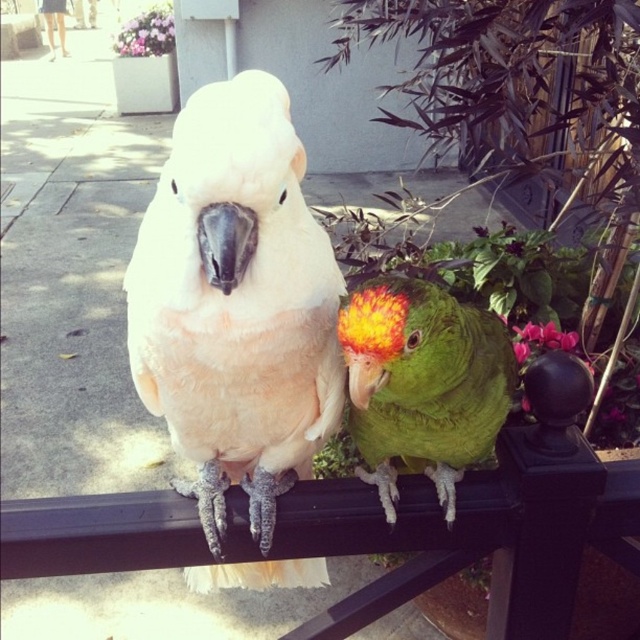
You are a birdwatcher trying to identify the parrots in the image. You notice both the white feathered parrot at center and the green matte parrot at center. Which parrot has a larger size?

The white feathered parrot at center is bigger than the green matte parrot at center.

You are standing at the base of the railing where the parrots are perched. You notice two points marked on the railing. The first point is at coordinates point (x=236, y=433) and the second point is at point (x=444, y=291). If you were to walk towards the parrot on the right, which point would you encounter first?

Point (x=444, y=291) would be encountered first because it is in front of point (x=236, y=433) according to their spatial relationship.

You are standing in a park and see two parrots on a black metal railing. The white feathered parrot at center and the green parrot on the right. There is a point marked at coordinate [236,301]. Which parrot is located at that point?

The white feathered parrot at center is located at point [236,301].